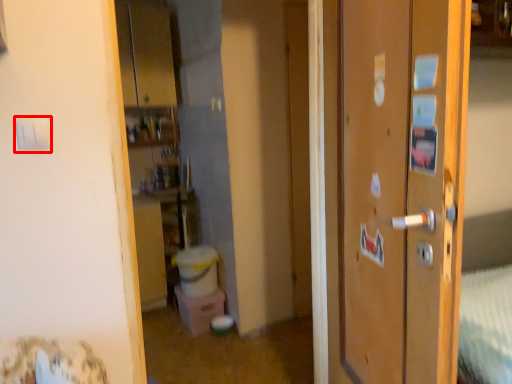
Question: In this image, where is light switch (annotated by the red box) located relative to door?

Choices:
 (A) right
 (B) left

Answer: (B)